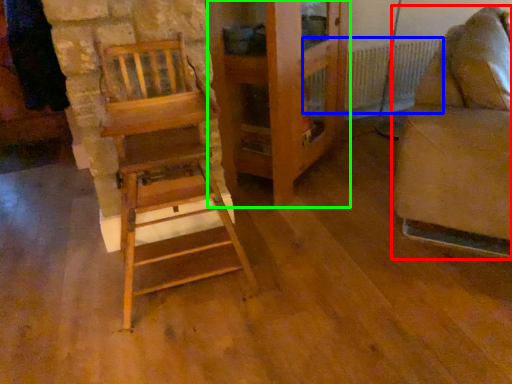
Question: Which object is the closest to the furniture (highlighted by a red box)? Choose among these: radiator (highlighted by a blue box) or dresser (highlighted by a green box).

Choices:
 (A) radiator
 (B) dresser

Answer: (B)